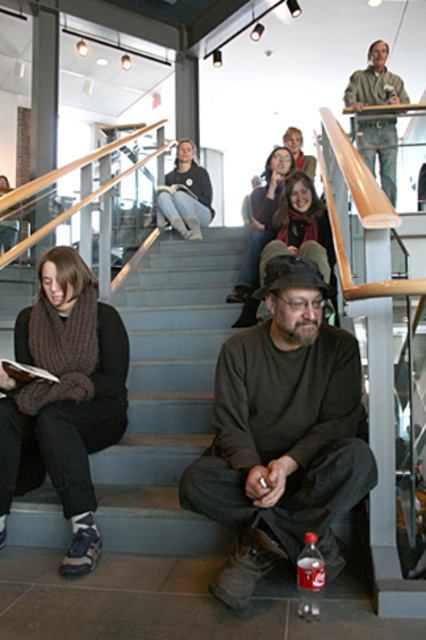
Question: Does knitted scarf at upper center appear on the left side of light brown leather jacket at upper center?

Choices:
 (A) no
 (B) yes

Answer: (B)

Question: Does dark brown sweater at center lie in front of knitted scarf at left?

Choices:
 (A) yes
 (B) no

Answer: (A)

Question: Estimate the real-world distances between objects in this image. Which object is closer to the knitted scarf at left?

Choices:
 (A) knitted scarf at upper center
 (B) light brown leather jacket at upper center
 (C) knitted scarf at center

Answer: (A)

Question: Among these objects, which one is nearest to the camera?

Choices:
 (A) knitted scarf at left
 (B) matte black jacket at upper center
 (C) knit scarf at upper center

Answer: (A)

Question: Does knitted scarf at upper center come behind knit scarf at upper center?

Choices:
 (A) yes
 (B) no

Answer: (B)

Question: Among these objects, which one is farthest from the camera?

Choices:
 (A) matte black jacket at upper center
 (B) dark brown sweater at center

Answer: (A)